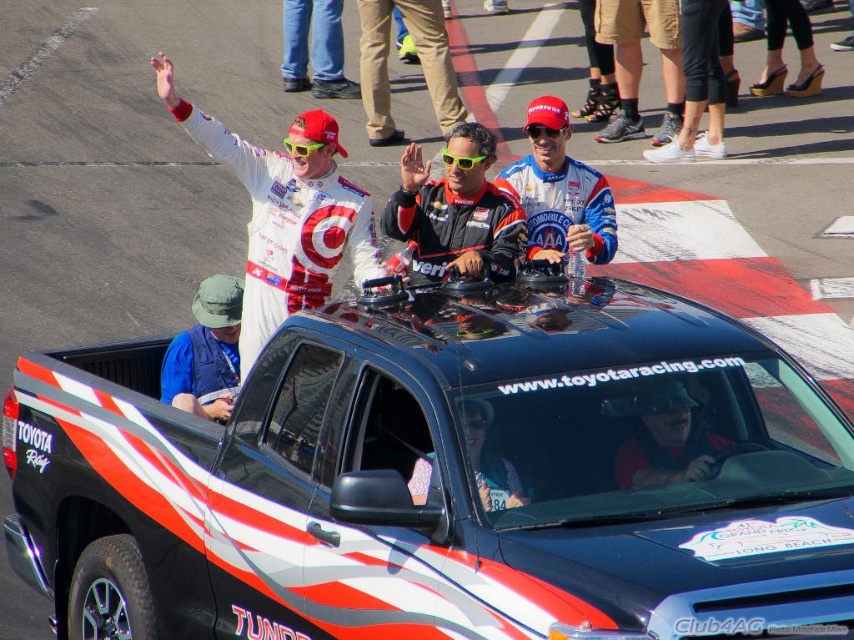
Does point (297, 140) lie behind point (496, 234)?

No.

Who is more forward, (354, 188) or (422, 250)?

Point (354, 188)

Which is in front, point (322, 176) or point (396, 218)?

Positioned in front is point (322, 176).

The height and width of the screenshot is (640, 854). I want to click on white glossy racing suit at upper left, so click(x=285, y=214).

Does green fabric hat at left appear over black leather helmet at center?

Yes, green fabric hat at left is above black leather helmet at center.

Does point (206, 339) come farther from viewer compared to point (714, 444)?

Yes.

This screenshot has width=854, height=640. I want to click on green fabric hat at left, so click(206, 352).

Can you confirm if black glossy pickup truck at center is smaller than white glossy racing suit at upper left?

No, black glossy pickup truck at center is not smaller than white glossy racing suit at upper left.

Does black glossy pickup truck at center have a larger size compared to white glossy racing suit at upper left?

Indeed, black glossy pickup truck at center has a larger size compared to white glossy racing suit at upper left.

What are the coordinates of `black glossy pickup truck at center` in the screenshot? It's located at (434, 481).

The image size is (854, 640). I want to click on black glossy pickup truck at center, so click(434, 481).